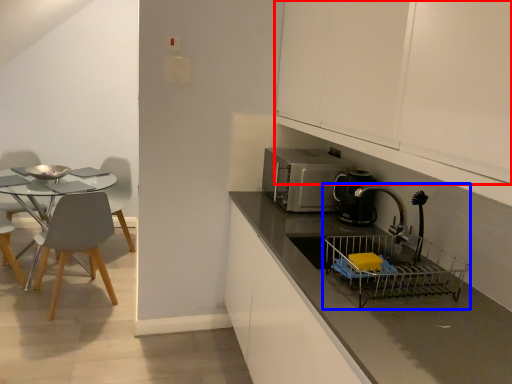
Question: Which object appears farthest to the camera in this image, cabinetry (highlighted by a red box) or sink (highlighted by a blue box)?

Choices:
 (A) cabinetry
 (B) sink

Answer: (B)